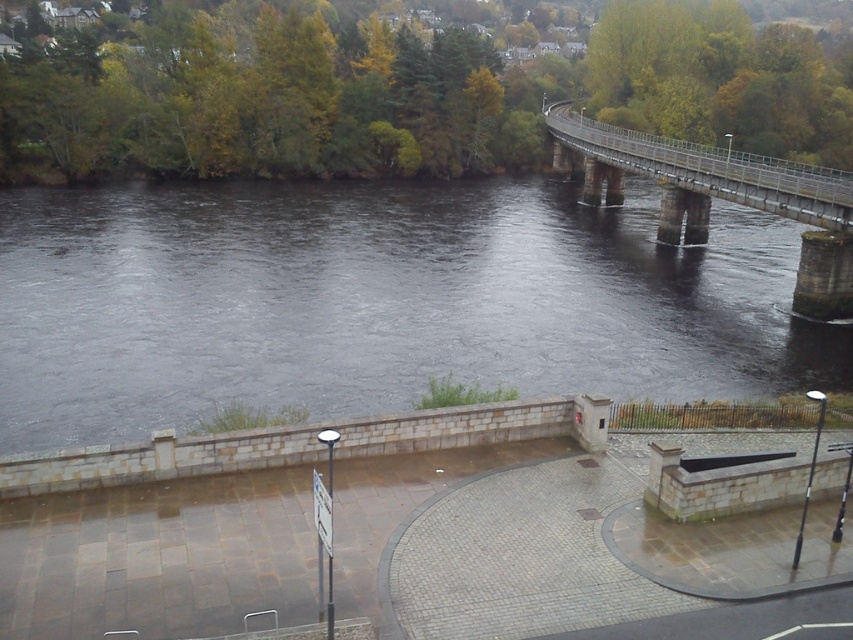
Question: Considering the relative positions of dark gray water at center and metallic gray bridge at upper right in the image provided, where is dark gray water at center located with respect to metallic gray bridge at upper right?

Choices:
 (A) right
 (B) left

Answer: (B)

Question: Which of the following is the farthest from the observer?

Choices:
 (A) (643, 156)
 (B) (216, 234)

Answer: (A)

Question: Which object appears closest to the camera in this image?

Choices:
 (A) metallic gray bridge at upper right
 (B) dark gray water at center

Answer: (B)

Question: Is dark gray water at center thinner than metallic gray bridge at upper right?

Choices:
 (A) no
 (B) yes

Answer: (A)

Question: In this image, where is dark gray water at center located relative to metallic gray bridge at upper right?

Choices:
 (A) above
 (B) below

Answer: (B)